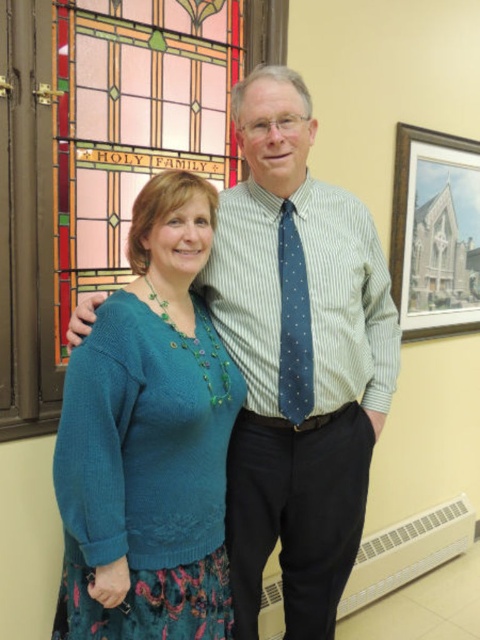
Can you confirm if striped cotton shirt at center is shorter than blue dotted tie at center?

No, striped cotton shirt at center is not shorter than blue dotted tie at center.

The height and width of the screenshot is (640, 480). In order to click on striped cotton shirt at center in this screenshot , I will do `click(312, 362)`.

Between teal knitted sweater at center and wooden framed print at upper right, which one has more height?

teal knitted sweater at center

In the scene shown: Who is more distant from viewer, (x=143, y=512) or (x=398, y=124)?

The point (x=398, y=124) is more distant.

Where is `teal knitted sweater at center`? The image size is (480, 640). teal knitted sweater at center is located at coordinates (148, 440).

Is wooden framed print at upper right shorter than blue dotted tie at center?

No, wooden framed print at upper right is not shorter than blue dotted tie at center.

Which is in front, point (406, 125) or point (283, 336)?

Point (283, 336) is more forward.

Between point (460, 150) and point (292, 291), which one is positioned behind?

Positioned behind is point (460, 150).

Where is `wooden framed print at upper right`? This screenshot has width=480, height=640. wooden framed print at upper right is located at coordinates (432, 237).